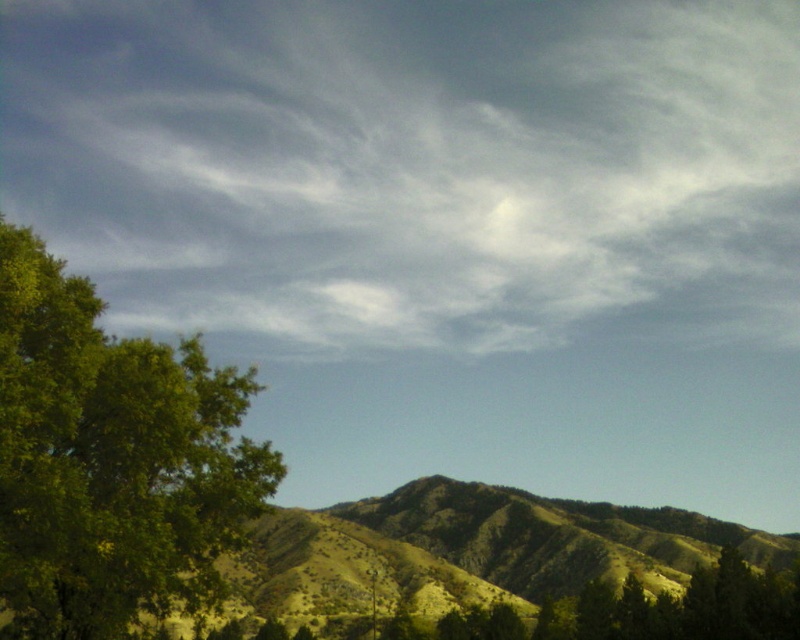
You are an astronomer observing the sky in the image. You notice a point at coordinates (414, 166). What celestial object is located at that point?

The point at coordinates (414, 166) marks a white fluffy cloud at upper center.

You are an astronomer observing the sky and the landscape. You notice the white fluffy cloud at upper center and the green leafy tree at left. Which object is higher in the sky?

The white fluffy cloud at upper center is higher in the sky than the green leafy tree at left because it is located above it.